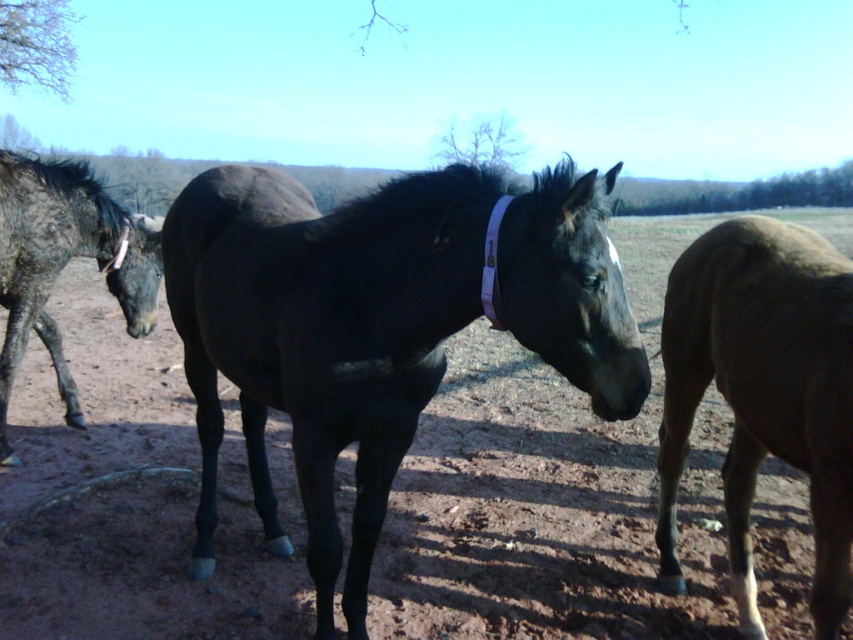
In the scene shown: You are a photographer setting up a tripod to take a photo of the brown matte horse at right and the speckled dark fur horse at left. If you want to ensure both horses are in focus, which horse should you focus on first considering their sizes?

The brown matte horse at right is not as tall as the speckled dark fur horse at left, so you should focus on the speckled dark fur horse at left first since it is larger and may require more precise focusing to capture details.